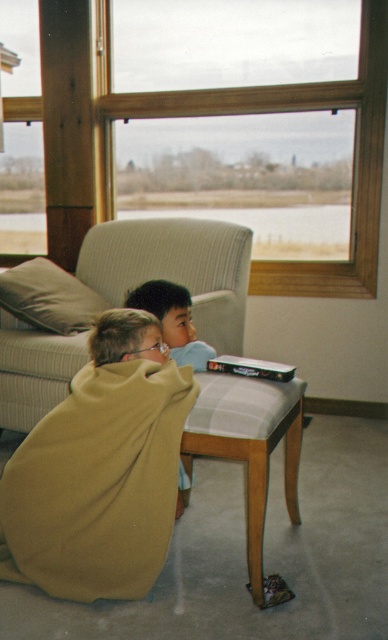
Question: Where is light gray fabric stool at lower center located in relation to light gray fabric pillow at left in the image?

Choices:
 (A) left
 (B) right

Answer: (B)

Question: Which object is the farthest from the matte blue shirt at center?

Choices:
 (A) light gray fabric pillow at left
 (B) gray fabric chair at center
 (C) soft yellow blanket at lower left
 (D) wooden frame at upper center

Answer: (D)

Question: Which point is farther from the camera taking this photo?

Choices:
 (A) (60, 301)
 (B) (256, 445)
 (C) (166, 342)
 (D) (362, 196)

Answer: (D)

Question: Considering the relative positions of light gray fabric pillow at left and matte blue shirt at center in the image provided, where is light gray fabric pillow at left located with respect to matte blue shirt at center?

Choices:
 (A) left
 (B) right

Answer: (A)

Question: Does gray fabric chair at center have a lesser width compared to matte blue shirt at center?

Choices:
 (A) no
 (B) yes

Answer: (A)

Question: Which object is positioned closest to the light gray fabric pillow at left?

Choices:
 (A) light gray fabric stool at lower center
 (B) soft yellow blanket at lower left

Answer: (B)